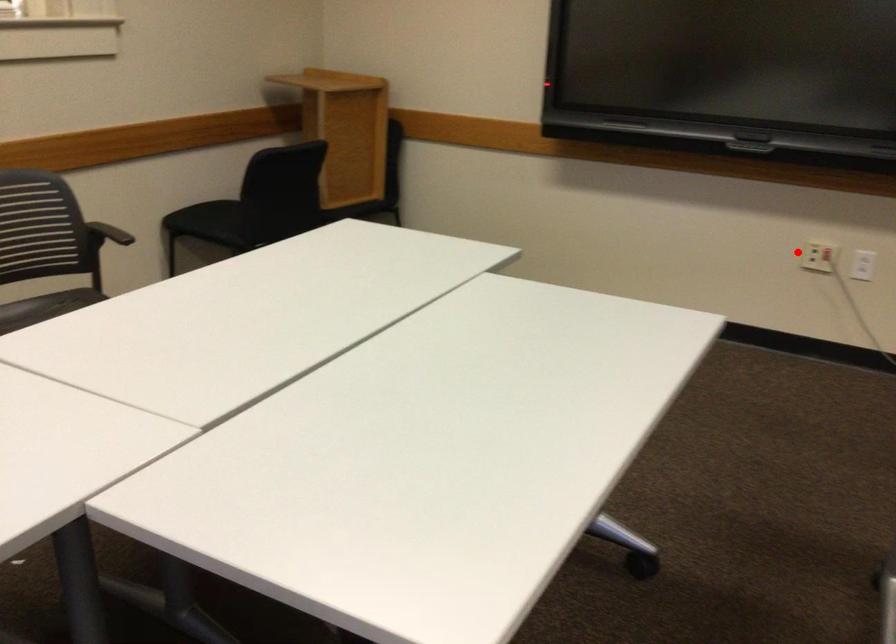
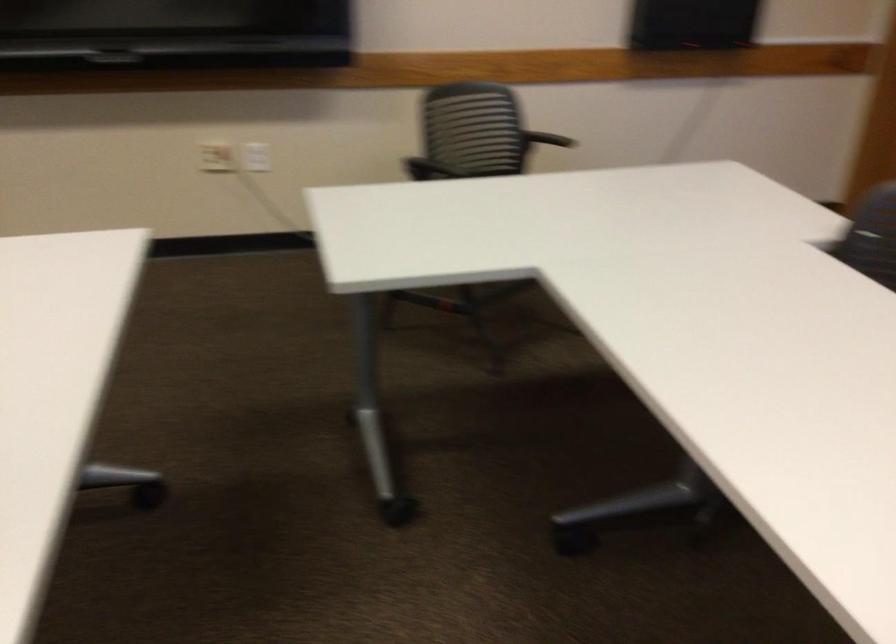
Where in the second image is the point corresponding to the highlighted location from the first image?

(216, 156)